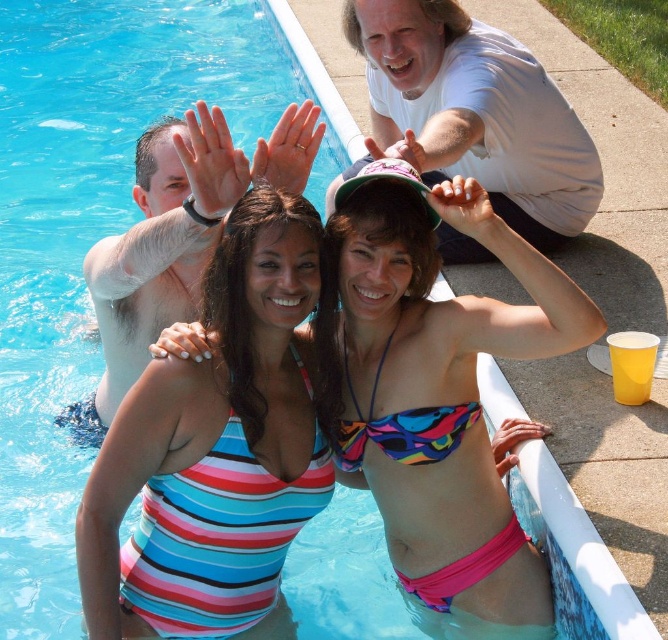
You are a photographer trying to capture both the striped fabric bikini at center and the multicolored printed bikini top at center in the same frame. Given their widths, which one should you position closer to the camera to ensure both fit in the frame?

Since the striped fabric bikini at center is wider than the multicolored printed bikini top at center, positioning the striped fabric bikini at center closer to the camera will help both fit within the frame.

You are a photographer standing at the edge of the pool. You want to take a photo of the smooth skin man at left and the multicolored fabric bikini at center. Which subject is positioned closer to the camera?

The smooth skin man at left is closer to the viewer than the multicolored fabric bikini at center, so the smooth skin man at left will appear larger in the photo.